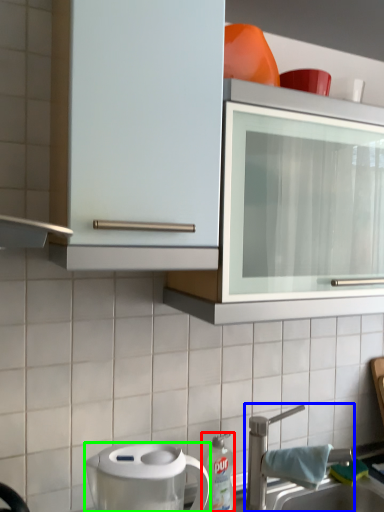
Question: Which is nearer to the kitchen appliance (highlighted by a red box)? tap (highlighted by a blue box) or home appliance (highlighted by a green box).

Choices:
 (A) tap
 (B) home appliance

Answer: (A)